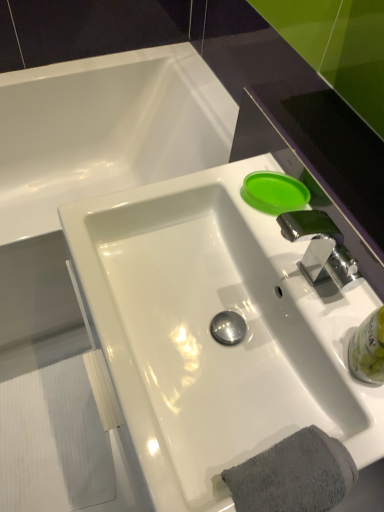
What is the approximate height of green matte lid at upper right, which is counted as the second liquid, starting from the bottom?

It is 3.25 centimeters.

I want to click on gray cotton towel at lower right, so click(x=294, y=475).

The height and width of the screenshot is (512, 384). I want to click on white glossy sink at center, so click(x=210, y=334).

Consider the image. Measure the distance between white glossy sink at center and camera.

They are 54.32 centimeters apart.

I want to click on green matte lid at upper right, the first liquid in the left-to-right sequence, so click(274, 192).

Between white glossy bathtub at upper left and clear plastic bottle at lower right, the second liquid positioned from the back, which one has larger size?

Bigger between the two is white glossy bathtub at upper left.

Is clear plastic bottle at lower right, the 1th liquid from the right, at the back of white glossy bathtub at upper left?

No, white glossy bathtub at upper left is not facing the opposite direction of clear plastic bottle at lower right, the 1th liquid from the right.

Does point (87, 156) come closer to viewer compared to point (362, 374)?

No.

Based on the photo, how different are the orientations of gray cotton towel at lower right and green matte lid at upper right, the first liquid in the left-to-right sequence, in degrees?

gray cotton towel at lower right and green matte lid at upper right, the first liquid in the left-to-right sequence, are facing 49.8 degrees away from each other.

Measure the distance between gray cotton towel at lower right and green matte lid at upper right, which appears as the 1th liquid when viewed from the back.

gray cotton towel at lower right and green matte lid at upper right, which appears as the 1th liquid when viewed from the back, are 17.12 inches apart from each other.

I want to click on bath towel lying in front of the green matte lid at upper right, which appears as the 1th liquid when viewed from the back, so click(294, 475).

From the picture: Is gray cotton towel at lower right bigger or smaller than green matte lid at upper right, the 2th liquid positioned from the front?

gray cotton towel at lower right is bigger than green matte lid at upper right, the 2th liquid positioned from the front.

Which of these two, white glossy sink at center or white glossy bathtub at upper left, is smaller?

white glossy sink at center is smaller.

Between white glossy sink at center and white glossy bathtub at upper left, which one has smaller width?

With smaller width is white glossy sink at center.

From a real-world perspective, does white glossy sink at center sit lower than white glossy bathtub at upper left?

No.

Considering the points (380, 368) and (265, 207), which point is behind, point (380, 368) or point (265, 207)?

The point (265, 207) is behind.

I want to click on liquid located on the right of green matte lid at upper right, positioned as the 1th liquid in top-to-bottom order, so click(368, 349).

Is clear plastic bottle at lower right, the 1th liquid viewed from the front, completely or partially outside of green matte lid at upper right, which is counted as the second liquid, starting from the bottom?

Yes, clear plastic bottle at lower right, the 1th liquid viewed from the front, is not within green matte lid at upper right, which is counted as the second liquid, starting from the bottom.

Considering the sizes of objects clear plastic bottle at lower right, the 1th liquid from the right, and green matte lid at upper right, positioned as the 1th liquid in top-to-bottom order, in the image provided, who is shorter, clear plastic bottle at lower right, the 1th liquid from the right, or green matte lid at upper right, positioned as the 1th liquid in top-to-bottom order,?

green matte lid at upper right, positioned as the 1th liquid in top-to-bottom order.

Can you confirm if clear plastic bottle at lower right, the 1th liquid viewed from the front, is bigger than white glossy bathtub at upper left?

No, clear plastic bottle at lower right, the 1th liquid viewed from the front, is not bigger than white glossy bathtub at upper left.

From the image's perspective, is clear plastic bottle at lower right, the 1th liquid positioned from the bottom, located above or below white glossy bathtub at upper left?

Clearly, from the image's perspective, clear plastic bottle at lower right, the 1th liquid positioned from the bottom, is below white glossy bathtub at upper left.

Is white glossy bathtub at upper left a part of clear plastic bottle at lower right, the second liquid positioned from the back?

No, clear plastic bottle at lower right, the second liquid positioned from the back, does not contain white glossy bathtub at upper left.

Consider the image. From a real-world perspective, is clear plastic bottle at lower right, the 1th liquid positioned from the bottom, physically above white glossy bathtub at upper left?

Yes, from a real-world perspective, clear plastic bottle at lower right, the 1th liquid positioned from the bottom, is over white glossy bathtub at upper left

In the image, is clear plastic bottle at lower right, the 1th liquid from the right, on the left side or the right side of white glossy sink at center?

Clearly, clear plastic bottle at lower right, the 1th liquid from the right, is on the right of white glossy sink at center in the image.

From a real-world perspective, is clear plastic bottle at lower right, the 1th liquid positioned from the bottom, positioned over white glossy sink at center based on gravity?

Yes, from a real-world perspective, clear plastic bottle at lower right, the 1th liquid positioned from the bottom, is on top of white glossy sink at center.

From the image's perspective, is clear plastic bottle at lower right, the 1th liquid positioned from the bottom, located beneath white glossy sink at center?

Yes, from the image's perspective, clear plastic bottle at lower right, the 1th liquid positioned from the bottom, is beneath white glossy sink at center.

Would you say white glossy bathtub at upper left is outside green matte lid at upper right, which is counted as the second liquid, starting from the bottom?

white glossy bathtub at upper left is positioned outside green matte lid at upper right, which is counted as the second liquid, starting from the bottom.

Identify the location of liquid that is the 1st one when counting rightward from the white glossy bathtub at upper left. This screenshot has height=512, width=384. (274, 192).

From the image's perspective, which one is positioned lower, white glossy bathtub at upper left or green matte lid at upper right, the 2th liquid positioned from the front?

green matte lid at upper right, the 2th liquid positioned from the front, appears lower in the image.

From a real-world perspective, which is physically below, white glossy bathtub at upper left or green matte lid at upper right, the 2th liquid positioned from the front?

white glossy bathtub at upper left is physically lower.

Starting from the white glossy bathtub at upper left, which liquid is the 2nd one in front? Please provide its 2D coordinates.

[(368, 349)]

From the image's perspective, which liquid is the 2nd one above the gray cotton towel at lower right? Please provide its 2D coordinates.

[(274, 192)]

From the image, which object appears to be farther from gray cotton towel at lower right, green matte lid at upper right, the 2th liquid positioned from the front, or clear plastic bottle at lower right, which is the second liquid in top-to-bottom order?

green matte lid at upper right, the 2th liquid positioned from the front, lies further to gray cotton towel at lower right than the other object.

Which object lies further to the anchor point green matte lid at upper right, which is counted as the second liquid, starting from the right, gray cotton towel at lower right or clear plastic bottle at lower right, the 1th liquid viewed from the front?

gray cotton towel at lower right lies further to green matte lid at upper right, which is counted as the second liquid, starting from the right, than the other object.

Considering their positions, is clear plastic bottle at lower right, placed as the second liquid when sorted from left to right, positioned closer to white glossy bathtub at upper left than gray cotton towel at lower right?

Based on the image, clear plastic bottle at lower right, placed as the second liquid when sorted from left to right, appears to be nearer to white glossy bathtub at upper left.

Looking at the image, which one is located further to clear plastic bottle at lower right, the 1th liquid from the right, green matte lid at upper right, positioned as the 1th liquid in top-to-bottom order, or white glossy sink at center?

green matte lid at upper right, positioned as the 1th liquid in top-to-bottom order, is further to clear plastic bottle at lower right, the 1th liquid from the right.

Looking at the image, which one is located further to clear plastic bottle at lower right, placed as the second liquid when sorted from left to right, green matte lid at upper right, the first liquid in the left-to-right sequence, or white glossy bathtub at upper left?

The object further to clear plastic bottle at lower right, placed as the second liquid when sorted from left to right, is white glossy bathtub at upper left.

From the image, which object appears to be nearer to white glossy sink at center, green matte lid at upper right, which is counted as the second liquid, starting from the right, or white glossy bathtub at upper left?

green matte lid at upper right, which is counted as the second liquid, starting from the right.

Considering their positions, is white glossy sink at center positioned closer to green matte lid at upper right, the 2th liquid positioned from the front, than gray cotton towel at lower right?

white glossy sink at center lies closer to green matte lid at upper right, the 2th liquid positioned from the front, than the other object.

Estimate the real-world distances between objects in this image. Which object is closer to gray cotton towel at lower right, white glossy sink at center or white glossy bathtub at upper left?

Based on the image, white glossy sink at center appears to be nearer to gray cotton towel at lower right.

Image resolution: width=384 pixels, height=512 pixels. In order to click on sink between white glossy bathtub at upper left and clear plastic bottle at lower right, the 1th liquid from the right, from left to right in this screenshot , I will do `click(210, 334)`.

Identify the location of liquid between white glossy sink at center and gray cotton towel at lower right from top to bottom. The width and height of the screenshot is (384, 512). (368, 349).

The image size is (384, 512). Find the location of `sink between green matte lid at upper right, the first liquid in the left-to-right sequence, and gray cotton towel at lower right in the up-down direction`. sink between green matte lid at upper right, the first liquid in the left-to-right sequence, and gray cotton towel at lower right in the up-down direction is located at coordinates (210, 334).

Locate an element on the screen. This screenshot has width=384, height=512. sink between white glossy bathtub at upper left and gray cotton towel at lower right vertically is located at coordinates (210, 334).